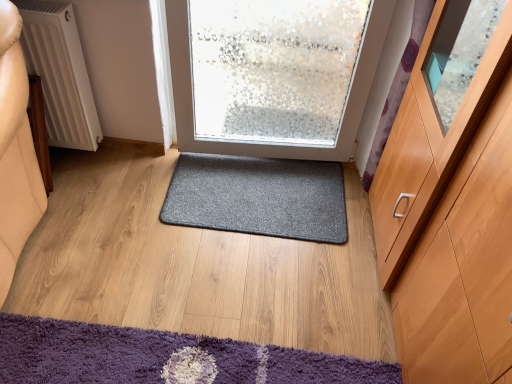
Question: Can you confirm if purple shaggy mat at lower left, which is the 1th mat in bottom-to-top order, is bigger than white textured radiator at left?

Choices:
 (A) yes
 (B) no

Answer: (B)

Question: Does purple shaggy mat at lower left, which is the 1th mat in bottom-to-top order, have a greater height compared to white textured radiator at left?

Choices:
 (A) no
 (B) yes

Answer: (A)

Question: Does purple shaggy mat at lower left, the second mat positioned from the top, appear on the left side of white textured radiator at left?

Choices:
 (A) yes
 (B) no

Answer: (B)

Question: Is purple shaggy mat at lower left, the second mat positioned from the top, completely or partially outside of white textured radiator at left?

Choices:
 (A) no
 (B) yes

Answer: (B)

Question: From a real-world perspective, is purple shaggy mat at lower left, which is the 1th mat in bottom-to-top order, on white textured radiator at left?

Choices:
 (A) yes
 (B) no

Answer: (B)

Question: Is white textured radiator at left located within purple shaggy mat at lower left, the second mat positioned from the top?

Choices:
 (A) no
 (B) yes

Answer: (A)

Question: Does purple shaggy mat at lower left, the 1th mat positioned from the front, have a greater height compared to dark gray carpet at center, placed as the first mat when sorted from top to bottom?

Choices:
 (A) no
 (B) yes

Answer: (B)

Question: Is purple shaggy mat at lower left, the second mat positioned from the top, aimed at dark gray carpet at center, positioned as the 1th mat in back-to-front order?

Choices:
 (A) no
 (B) yes

Answer: (A)

Question: Considering the relative sizes of purple shaggy mat at lower left, which is the 1th mat in bottom-to-top order, and dark gray carpet at center, positioned as the 1th mat in back-to-front order, in the image provided, is purple shaggy mat at lower left, which is the 1th mat in bottom-to-top order, bigger than dark gray carpet at center, positioned as the 1th mat in back-to-front order,?

Choices:
 (A) yes
 (B) no

Answer: (A)

Question: Does purple shaggy mat at lower left, the second mat viewed from the back, have a lesser height compared to dark gray carpet at center, placed as the first mat when sorted from top to bottom?

Choices:
 (A) yes
 (B) no

Answer: (B)

Question: Is purple shaggy mat at lower left, which is the 1th mat in bottom-to-top order, wider than dark gray carpet at center, the second mat when ordered from bottom to top?

Choices:
 (A) yes
 (B) no

Answer: (A)

Question: Is the surface of purple shaggy mat at lower left, the second mat positioned from the top, in direct contact with dark gray carpet at center, placed as the first mat when sorted from top to bottom?

Choices:
 (A) no
 (B) yes

Answer: (A)

Question: Is light brown wood cabinet at right not inside dark gray carpet at center, placed as the first mat when sorted from top to bottom?

Choices:
 (A) yes
 (B) no

Answer: (A)